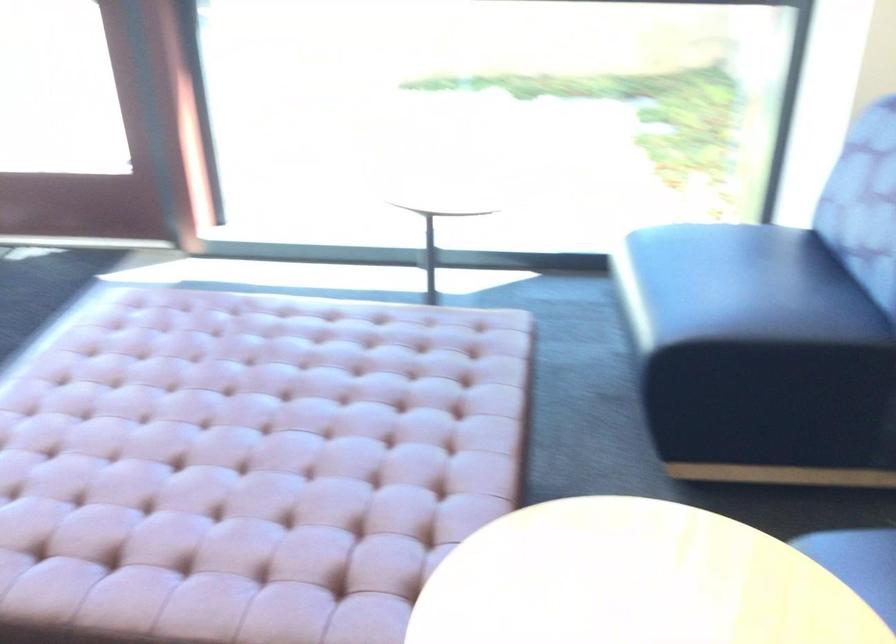
The width and height of the screenshot is (896, 644). Describe the element at coordinates (724, 301) in the screenshot. I see `the blue sofa sitting surface` at that location.